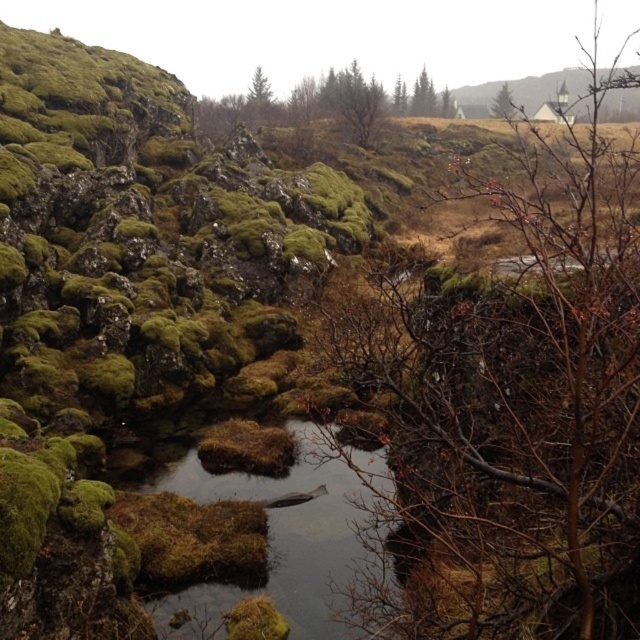
You are a hiker trying to navigate through the rocky terrain. You see the green mossy rock at upper center and the green mossy tree at upper right. Which object is positioned to the left when viewed from your perspective?

The green mossy rock at upper center is to the left of the green mossy tree at upper right, so the green mossy rock at upper center is positioned to the left.

You are standing at the edge of the small body of water in the foreground and want to walk to the point labeled as point [278,588]. Which direction should you move relative to the other point labeled point [444,625]?

You should move towards the area behind the point labeled point [444,625] because point [278,588] is located behind it according to the spatial relationship provided.